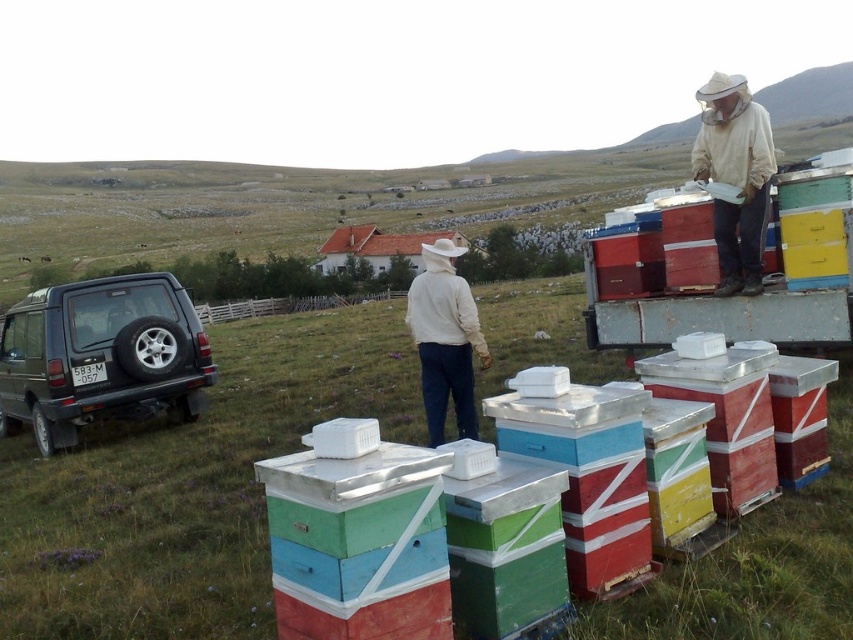
You are a photographer standing in the field and want to capture both the white mesh hat at upper right and the white matte jacket at center in a single frame. Based on their positions, will you need to adjust your camera angle upwards or downwards to include both in the shot?

The white mesh hat at upper right is located above the white matte jacket at center, so you will need to adjust your camera angle downwards to include both in the shot.